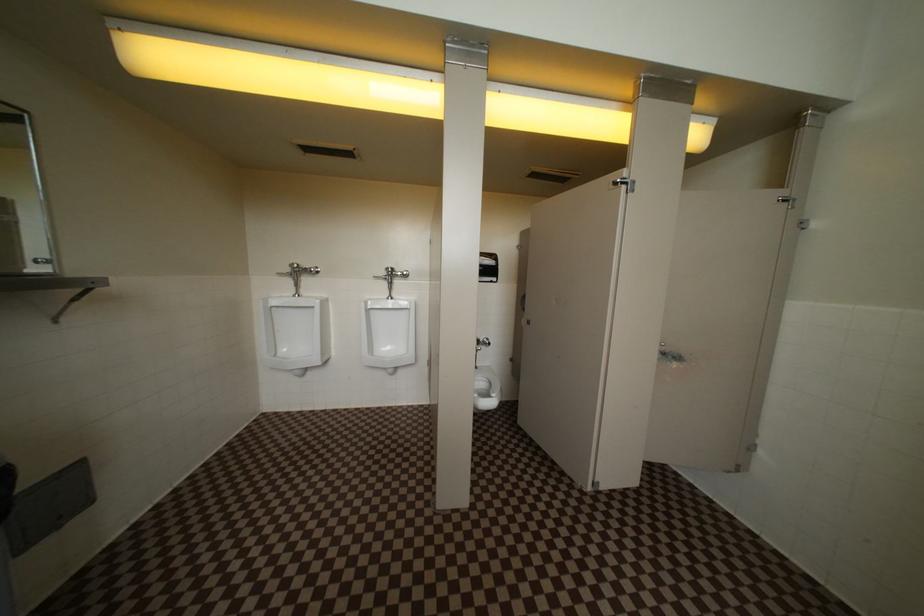
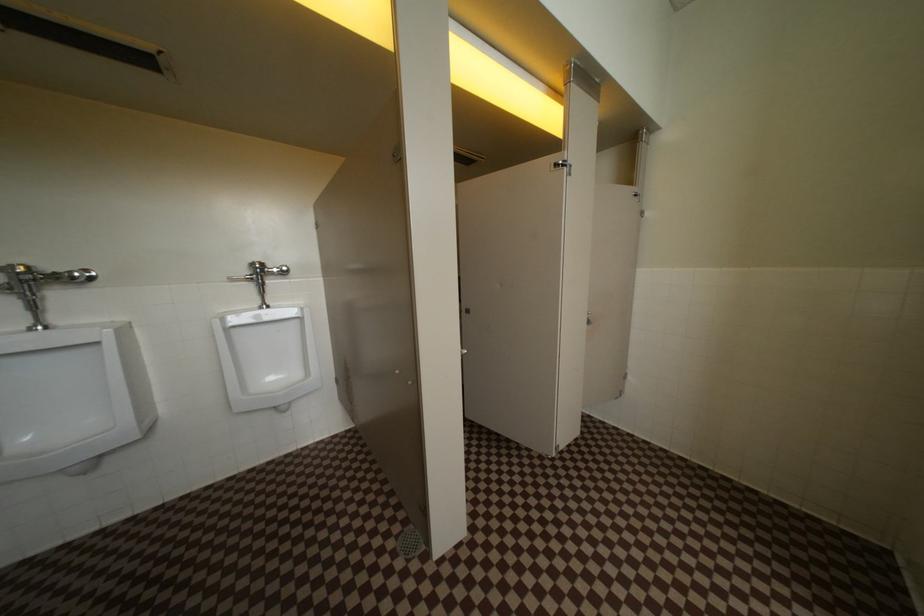
Question: How did the camera likely rotate?

Choices:
 (A) Left
 (B) Right
 (C) Up
 (D) Down

Answer: (B)